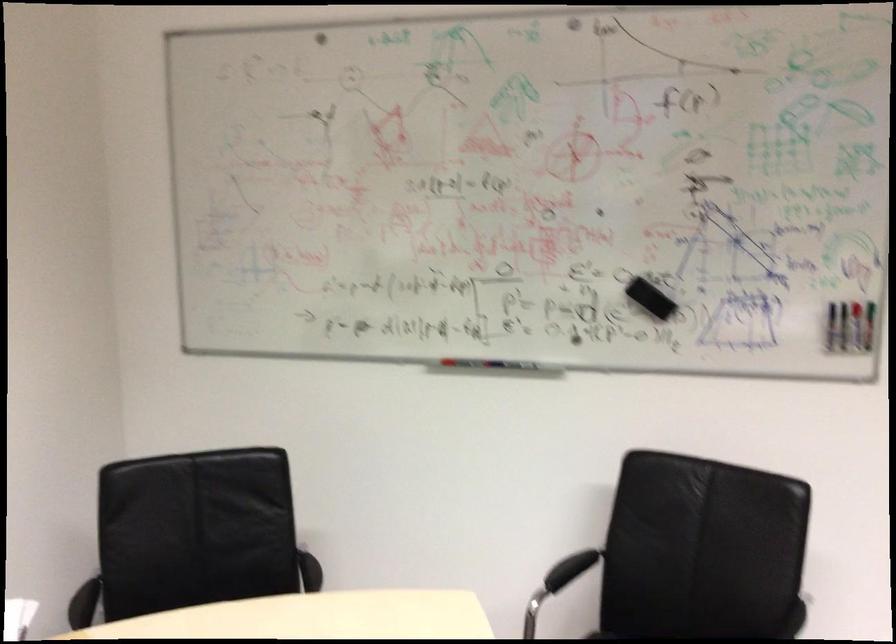
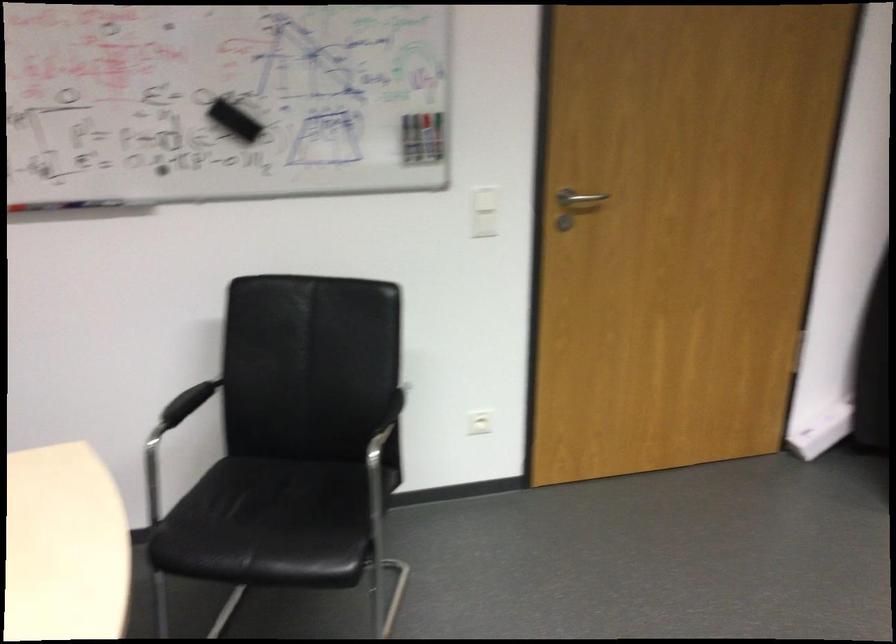
Question: The images are taken continuously from a first-person perspective. In which direction are you moving?

Choices:
 (A) Left
 (B) Right
 (C) Forward
 (D) Backward

Answer: (B)